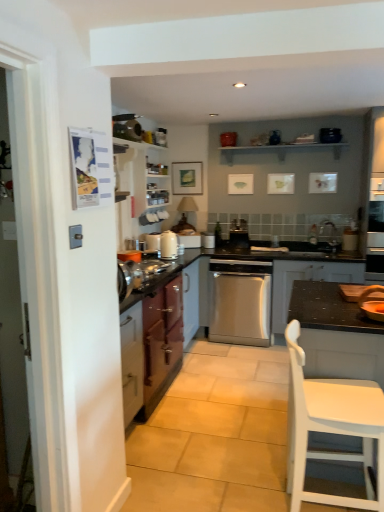
Question: From a real-world perspective, is metallic purple cabinet at left, the 3th cabinetry viewed from the right, physically located above or below dark gray matte cabinet at center, the 3th cabinetry when ordered from left to right?

Choices:
 (A) above
 (B) below

Answer: (A)

Question: Based on their sizes in the image, would you say metallic purple cabinet at left, which is the 1th cabinetry from left to right, is bigger or smaller than dark gray matte cabinet at center, the 3th cabinetry when ordered from left to right?

Choices:
 (A) big
 (B) small

Answer: (A)

Question: Which object is the farthest from the white wooden shelf at upper center?

Choices:
 (A) satin silver coffee machine at center, the 2th appliance when ordered from front to back
 (B) white plastic chair at lower right
 (C) matte wooden picture frame at upper center
 (D) dark gray matte cabinet at center, the 3th cabinetry when ordered from left to right
 (E) metallic purple cabinet at left, which is the 1th cabinetry from left to right

Answer: (B)

Question: Estimate the real-world distances between objects in this image. Which object is farther from the wooden shelves at upper center, positioned as the 2th cabinetry in left-to-right order?

Choices:
 (A) dark gray matte cabinet at center, marked as the 1th cabinetry in a right-to-left arrangement
 (B) wooden bowl at right, the third appliance from the back
 (C) satin stainless steel dishwasher at center
 (D) white plastic chair at lower right
 (E) white glossy kettle at center

Answer: (D)